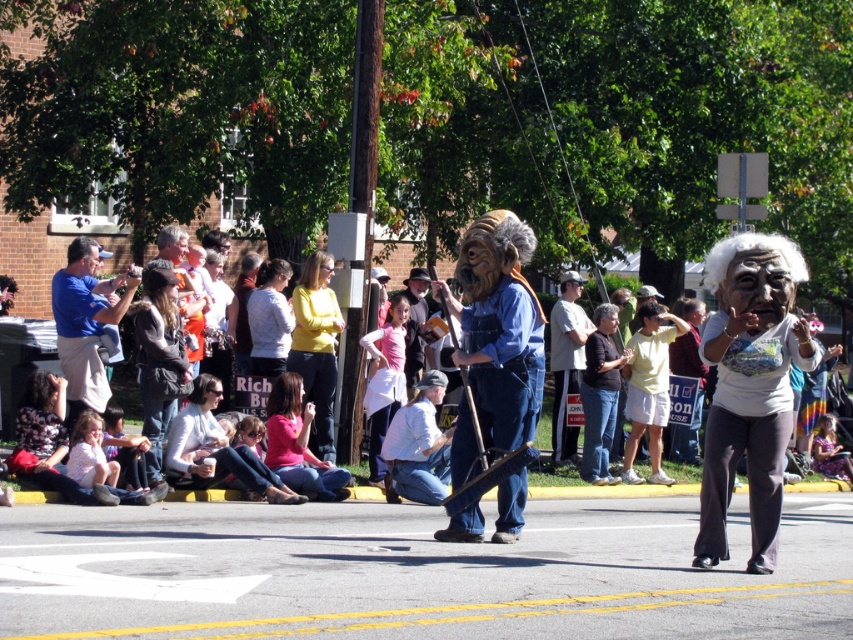
Question: Based on their relative distances, which object is farther from the gray synthetic wig at upper left?

Choices:
 (A) blonde synthetic wig at center
 (B) yellow matte shirt at center
 (C) matte blue overalls at center

Answer: (C)

Question: Can you confirm if orange fabric bag at center is positioned below blonde synthetic wig at center?

Choices:
 (A) yes
 (B) no

Answer: (A)

Question: Can you confirm if dark brown leather jacket at lower left is positioned to the right of yellow matte shirt at center?

Choices:
 (A) yes
 (B) no

Answer: (B)

Question: Is yellow matte shirt at center to the right of dark brown leather jacket at center from the viewer's perspective?

Choices:
 (A) no
 (B) yes

Answer: (A)

Question: Which of these objects is positioned farthest from the gray synthetic wig at upper left?

Choices:
 (A) gray fabric mask at center
 (B) blue fabric shirt at left
 (C) yellow matte shirt at center
 (D) light gray sweater at center

Answer: (A)

Question: Among these points, which one is farthest from the camera?

Choices:
 (A) (167, 241)
 (B) (259, 273)

Answer: (B)